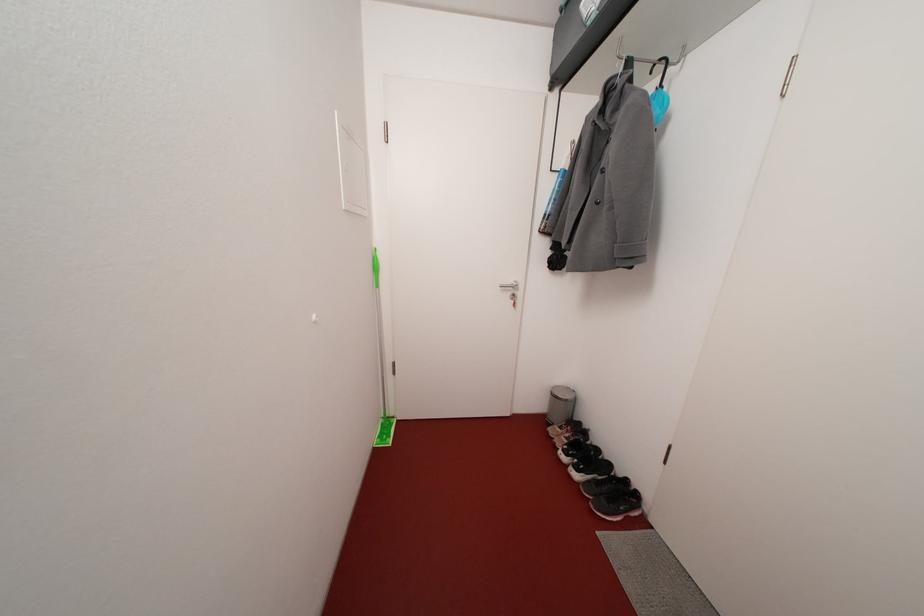
Find where to grasp the green floor sweeper. Please return your answer as a coordinate pair (x, y).

(381, 363)